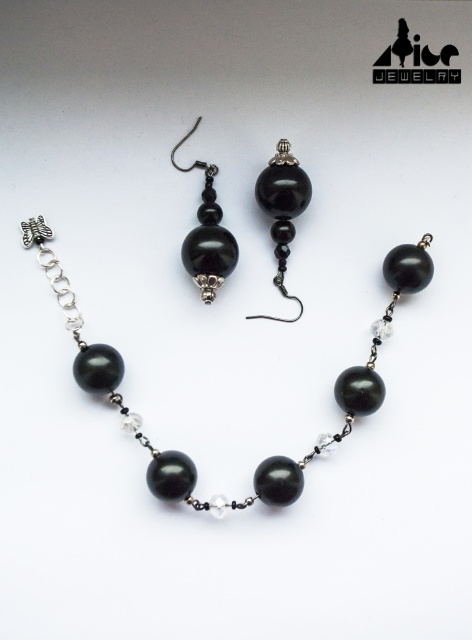
Looking at this image, looking at the jewelry display, both the necklace and earrings have a central bead. Which bead is taller between the black glossy bead at center and the black glass bead at center?

The black glossy bead at center is taller than the black glass bead at center.

You are a customer at a jewelry store and want to know which item is taller between the black pearl necklace at center and the black glossy bead at center. Can you tell me?

The black pearl necklace at center is taller than the black glossy bead at center.